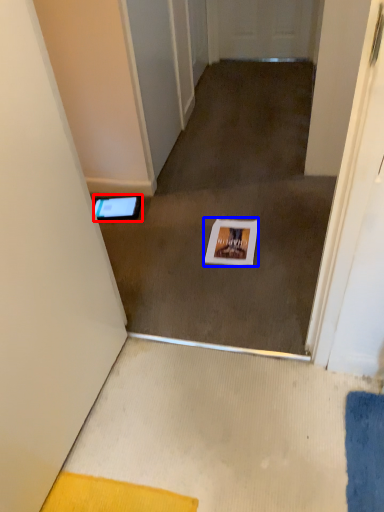
Question: Among these objects, which one is farthest to the camera, tablet computer (highlighted by a red box) or postcard (highlighted by a blue box)?

Choices:
 (A) tablet computer
 (B) postcard

Answer: (A)